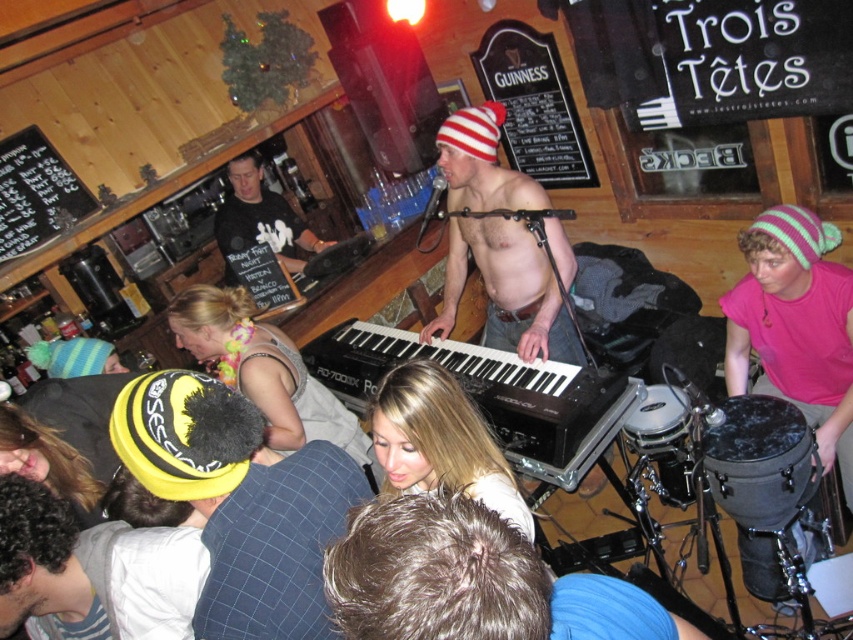
Question: Is yellow fuzzy hat at lower left to the left of black matte shirt at center from the viewer's perspective?

Choices:
 (A) no
 (B) yes

Answer: (A)

Question: Is black chalkboard at upper left positioned in front of black matte shirt at center?

Choices:
 (A) no
 (B) yes

Answer: (B)

Question: Considering the relative positions of shiny metallic keyboard at center and black chalkboard at upper left in the image provided, where is shiny metallic keyboard at center located with respect to black chalkboard at upper left?

Choices:
 (A) left
 (B) right

Answer: (B)

Question: Which point appears farthest from the camera in this image?

Choices:
 (A) (x=279, y=252)
 (B) (x=462, y=381)

Answer: (A)

Question: Which point is closer to the camera?

Choices:
 (A) yellow fuzzy hat at lower left
 (B) black matte shirt at center
 (C) black chalkboard at upper center

Answer: (A)

Question: Among these objects, which one is farthest from the camera?

Choices:
 (A) shiny metallic keyboard at center
 (B) black plastic keyboard at center
 (C) black matte shirt at center

Answer: (C)